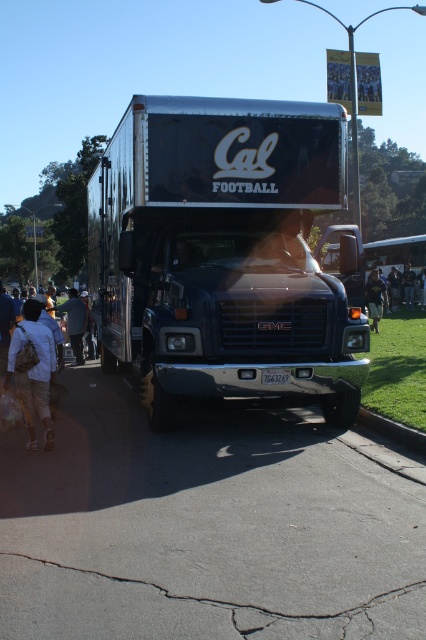
You are a photographer trying to capture both the shiny black truck at center and the dark blue shirt at center in a single shot. Since the truck is larger, how might you adjust your camera position to ensure both are visible and proportionally balanced in the frame?

Since the shiny black truck at center is larger than the dark blue shirt at center, you can move closer to the dark blue shirt at center or use a wider angle lens to include both subjects while maintaining a balanced composition.